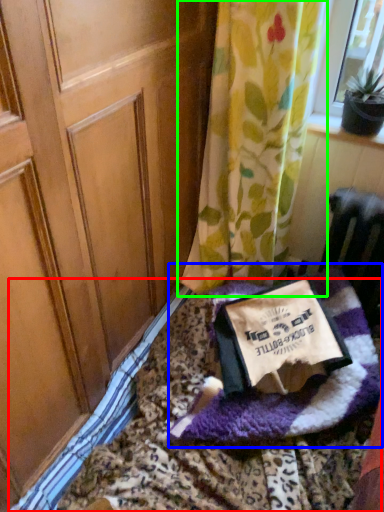
Question: Which object is positioned farthest from bedding (highlighted by a red box)? Select from blanket (highlighted by a blue box) and curtain (highlighted by a green box).

Choices:
 (A) blanket
 (B) curtain

Answer: (B)